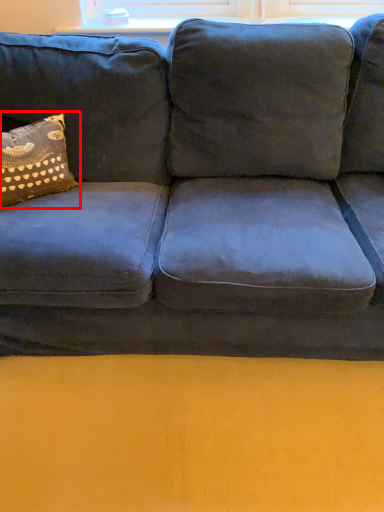
Question: Where is pillow (annotated by the red box) located in relation to window sill in the image?

Choices:
 (A) left
 (B) right

Answer: (A)